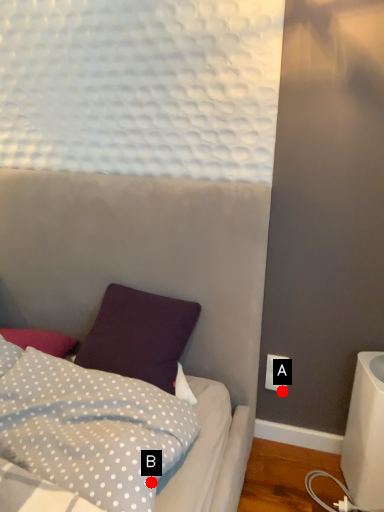
Question: Two points are circled on the image, labeled by A and B beside each circle. Among these points, which one is farthest from the camera?

Choices:
 (A) A is further
 (B) B is further

Answer: (A)